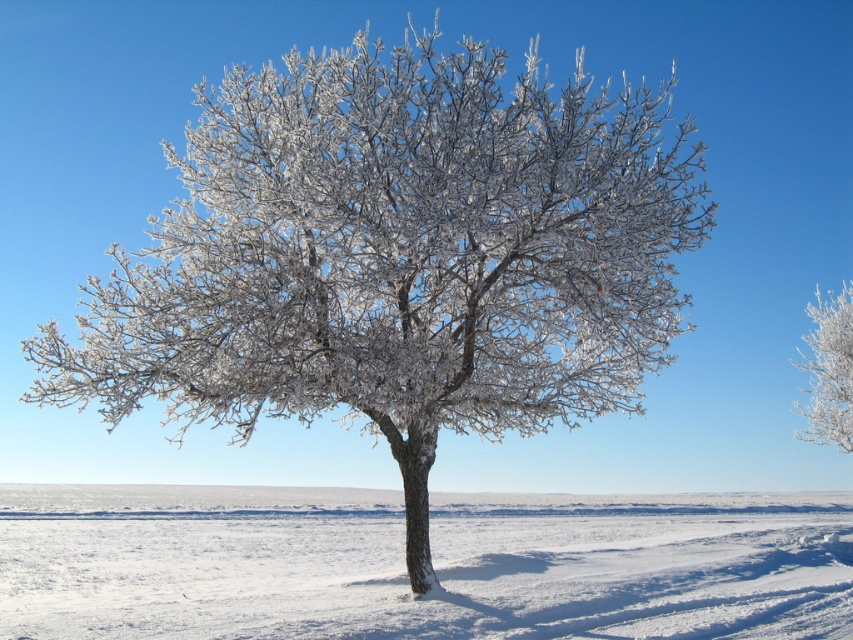
You are an observer looking at the winter scene. You see the white frosty snow at center and the frosted white tree at right. Which object appears taller in the image?

The white frosty snow at center is much taller than the frosted white tree at right according to the description.

You are an observer standing at the edge of the snowy landscape. You see the white frosty snow at center and the frosted white tree at right. Which object is positioned to the right side of the scene?

The frosted white tree at right is positioned to the right side of the scene.

You are standing in the winter landscape and want to place a small decoration at the point closer to you between point (834, 625) and point (842, 349). Which point should you choose?

You should choose point (834, 625) because it is closer to you than point (842, 349).